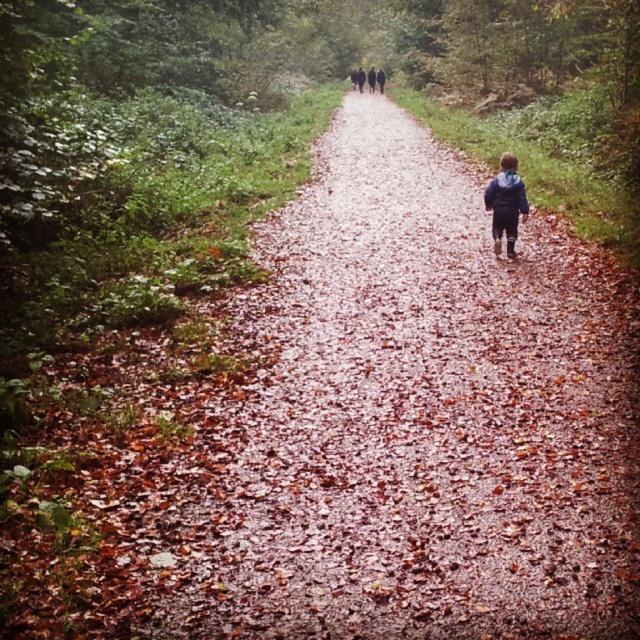
Based on the photo, you are a hiker on the forest path and see the blue fabric jacket at center and the dark blue jacket at center ahead of you. Which jacket is closer to you?

The blue fabric jacket at center is closer to you because it is in front of the dark blue jacket at center.

You are a hiker trying to identify clothing colors along the forest path. You see a blue fabric jacket at center and a dark blue jacket at center. Which jacket is narrower in width?

The blue fabric jacket at center is narrower in width than the dark blue jacket at center.

You are a hiker on a forest path and see two people wearing jackets ahead of you. One is wearing a blue fabric jacket at center and the other a dark blue jacket at center. Which jacket is to the right when looking towards the direction they are walking?

The blue fabric jacket at center is positioned on the right side of dark blue jacket at center, so when looking towards the direction they are walking, the blue fabric jacket at center is to the right.